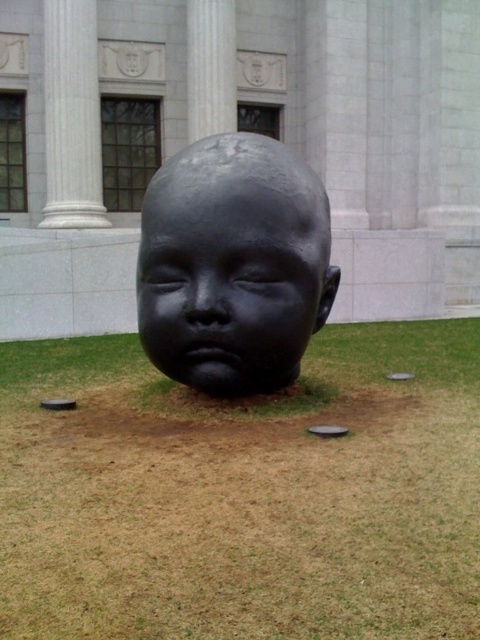
You are standing at the center of the image and want to place a small decorative rock exactly at the location marked by the green grass at center. According to the coordinates provided, where should you place the rock?

The green grass at center is located at coordinates point (242, 493), so you should place the rock there.